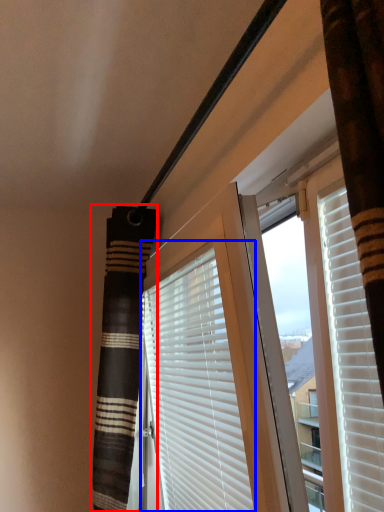
Question: Among these objects, which one is nearest to the camera, shower curtain (highlighted by a red box) or window blind (highlighted by a blue box)?

Choices:
 (A) shower curtain
 (B) window blind

Answer: (B)